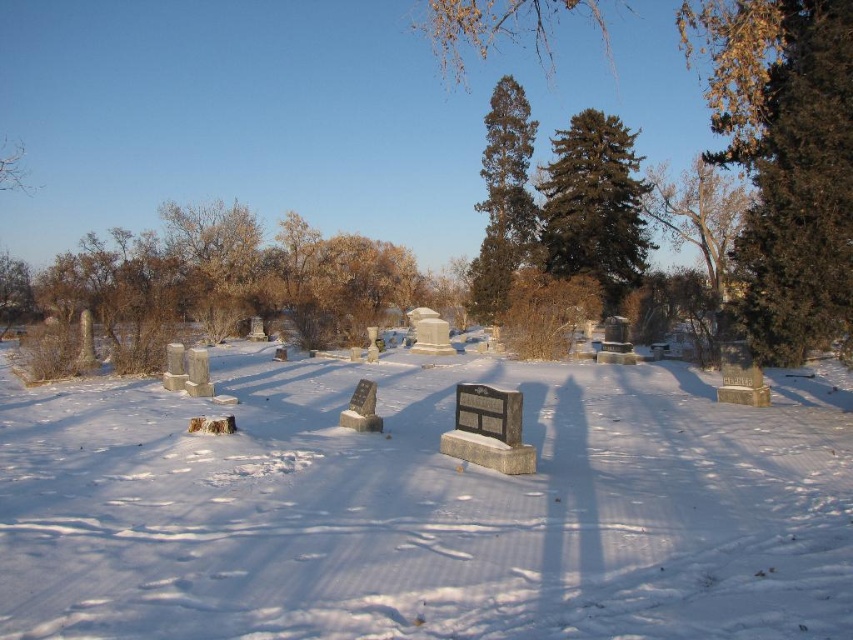
Question: Which point is closer to the camera taking this photo?

Choices:
 (A) (486, 122)
 (B) (196, 252)

Answer: (A)

Question: Does green textured evergreen tree at center have a smaller size compared to polished granite gravestone at center?

Choices:
 (A) no
 (B) yes

Answer: (A)

Question: Is green textured evergreen tree at center above dark gray stone bench at center?

Choices:
 (A) no
 (B) yes

Answer: (B)

Question: Can you confirm if brown textured tree at upper left is smaller than green needle-like at center?

Choices:
 (A) yes
 (B) no

Answer: (B)

Question: Which of the following is the closest to the observer?

Choices:
 (A) (756, 116)
 (B) (473, 628)
 (C) (440, 448)
 (D) (318, 244)

Answer: (B)

Question: Which point is closer to the camera?

Choices:
 (A) dark green coniferous tree at center
 (B) dark gray stone bench at center
 (C) polished granite gravestone at center
 (D) green textured evergreen tree at center

Answer: (B)